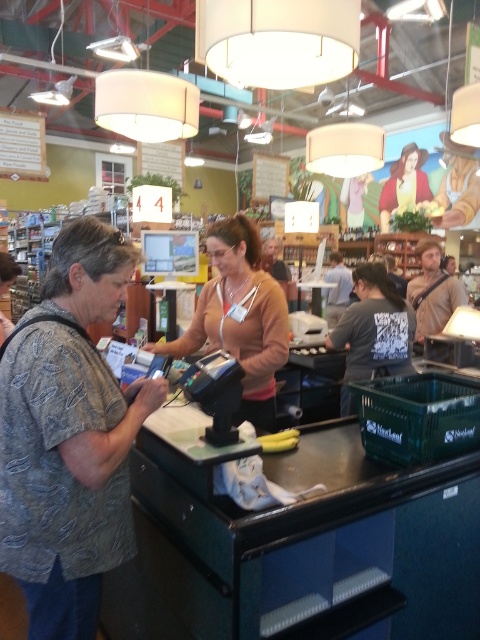
Which is below, matte brown sweater at center or brown leather bag at center?

matte brown sweater at center

Who is positioned more to the left, matte brown sweater at center or brown leather bag at center?

matte brown sweater at center

The width and height of the screenshot is (480, 640). What are the coordinates of `matte brown sweater at center` in the screenshot? It's located at 240,317.

Between dark gray t-shirt at center and dark gray sweater at center, which one appears on the left side from the viewer's perspective?

dark gray t-shirt at center is more to the left.

Is point (336, 339) positioned behind point (325, 296)?

No, it is in front of (325, 296).

In order to click on dark gray t-shirt at center in this screenshot , I will do `click(372, 330)`.

Consider the image. Which is below, gray printed shirt at left or matte brown sweater at center?

gray printed shirt at left is lower down.

Locate an element on the screen. This screenshot has width=480, height=640. gray printed shirt at left is located at coordinates (69, 436).